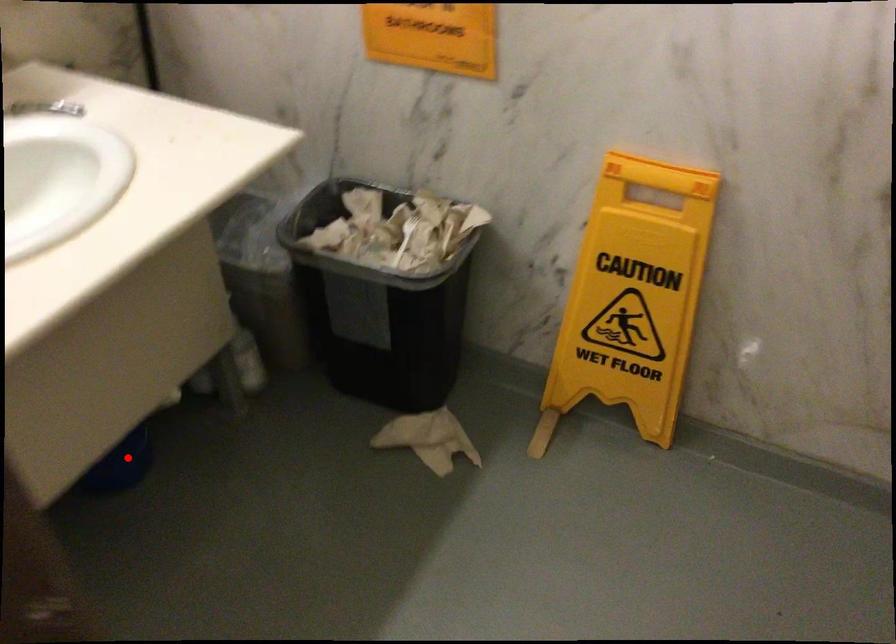
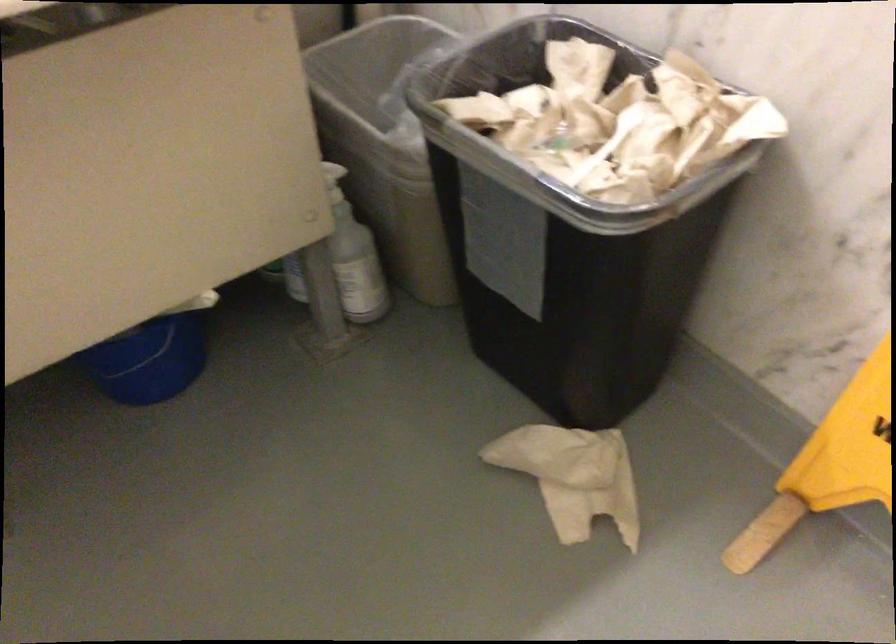
In the second image, find the point that corresponds to the highlighted location in the first image.

(149, 361)